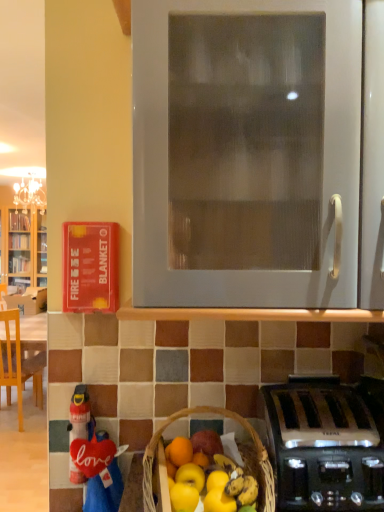
Question: From the image's perspective, is white matte oven at center located beneath red fabric love sign at lower left?

Choices:
 (A) no
 (B) yes

Answer: (A)

Question: From the image's perspective, does white matte oven at center appear higher than red fabric love sign at lower left?

Choices:
 (A) yes
 (B) no

Answer: (A)

Question: Is white matte oven at center at the right side of red fabric love sign at lower left?

Choices:
 (A) yes
 (B) no

Answer: (A)

Question: Can you confirm if white matte oven at center is bigger than red fabric love sign at lower left?

Choices:
 (A) no
 (B) yes

Answer: (B)

Question: Is white matte oven at center oriented towards red fabric love sign at lower left?

Choices:
 (A) yes
 (B) no

Answer: (B)

Question: From a real-world perspective, is white matte oven at center above or below brown wicker basket at lower center?

Choices:
 (A) below
 (B) above

Answer: (B)

Question: Is white matte oven at center bigger or smaller than brown wicker basket at lower center?

Choices:
 (A) small
 (B) big

Answer: (B)

Question: From the image's perspective, is white matte oven at center positioned above or below brown wicker basket at lower center?

Choices:
 (A) above
 (B) below

Answer: (A)

Question: Looking at their shapes, would you say white matte oven at center is wider or thinner than brown wicker basket at lower center?

Choices:
 (A) thin
 (B) wide

Answer: (A)

Question: Is wooden chair at left in front of or behind white matte oven at center in the image?

Choices:
 (A) front
 (B) behind

Answer: (B)

Question: Looking at their shapes, would you say wooden chair at left is wider or thinner than white matte oven at center?

Choices:
 (A) wide
 (B) thin

Answer: (A)

Question: From the image's perspective, is wooden chair at left positioned above or below white matte oven at center?

Choices:
 (A) above
 (B) below

Answer: (B)

Question: Considering the positions of point (4, 340) and point (226, 179), is point (4, 340) closer or farther from the camera than point (226, 179)?

Choices:
 (A) farther
 (B) closer

Answer: (A)

Question: Relative to wooden chair at left, is white matte oven at center in front or behind?

Choices:
 (A) behind
 (B) front

Answer: (B)

Question: Choose the correct answer: Is white matte oven at center inside wooden chair at left or outside it?

Choices:
 (A) outside
 (B) inside

Answer: (A)